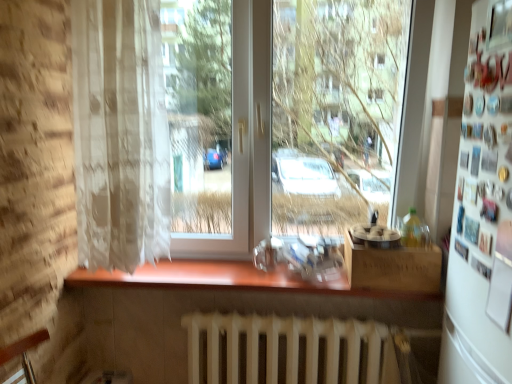
Question: Is wooden box at lower right bigger than transparent glass window at center?

Choices:
 (A) no
 (B) yes

Answer: (A)

Question: Is wooden box at lower right shorter than transparent glass window at center?

Choices:
 (A) no
 (B) yes

Answer: (B)

Question: Does wooden box at lower right have a smaller size compared to transparent glass window at center?

Choices:
 (A) yes
 (B) no

Answer: (A)

Question: Does wooden box at lower right have a lesser width compared to transparent glass window at center?

Choices:
 (A) no
 (B) yes

Answer: (B)

Question: Does wooden box at lower right contain transparent glass window at center?

Choices:
 (A) yes
 (B) no

Answer: (B)

Question: Is wooden box at lower right located outside transparent glass window at center?

Choices:
 (A) yes
 (B) no

Answer: (B)

Question: Is white matte radiator at lower center outside of wooden box at lower right?

Choices:
 (A) yes
 (B) no

Answer: (A)

Question: Can you confirm if white matte radiator at lower center is thinner than wooden box at lower right?

Choices:
 (A) yes
 (B) no

Answer: (A)

Question: From a real-world perspective, does white matte radiator at lower center sit lower than wooden box at lower right?

Choices:
 (A) no
 (B) yes

Answer: (B)

Question: Is white matte radiator at lower center shorter than wooden box at lower right?

Choices:
 (A) yes
 (B) no

Answer: (B)

Question: Does white matte radiator at lower center have a greater width compared to wooden box at lower right?

Choices:
 (A) yes
 (B) no

Answer: (B)

Question: Is the position of white matte radiator at lower center less distant than that of wooden box at lower right?

Choices:
 (A) yes
 (B) no

Answer: (A)

Question: Is wooden counter at center closer to the viewer compared to white matte radiator at lower center?

Choices:
 (A) yes
 (B) no

Answer: (B)